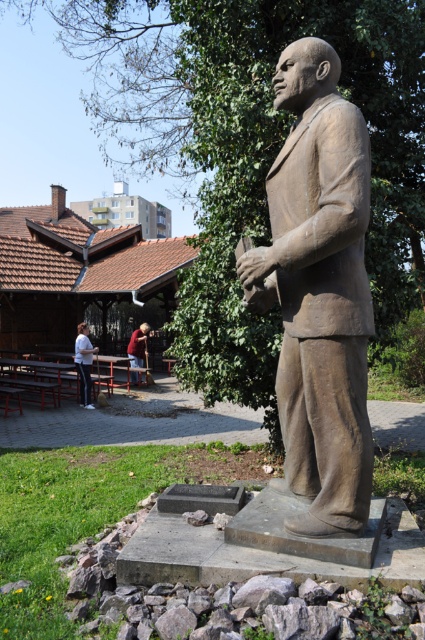
You are standing in a park and want to take a photo of the bronze statue of a man holding a rolled document in his left hand. The statue is on a rectangular stone pedestal surrounded by rocks and grass. There is a point at coordinates point [333,378] that is 11.52 feet away from you. If you move forward 5 feet, will you be closer to the statue than the point?

The point [333,378] is 11.52 feet away. Moving forward 5 feet reduces the distance to 6.52 feet. Since the statue is at the same location as the point, you will be closer to both the statue and the point after moving forward.

You are a photographer wanting to capture both the bronze statue at center and the red shirt at lower left in the same frame. Based on their positions, which object is higher in the image?

The bronze statue at center is above the red shirt at lower left, so the bronze statue at center appears higher in the image.

You are standing at the point marked as point (319, 291) in the image. Which object are you currently standing on?

You are standing on the bronze statue at center because the point (319, 291) is located on it.